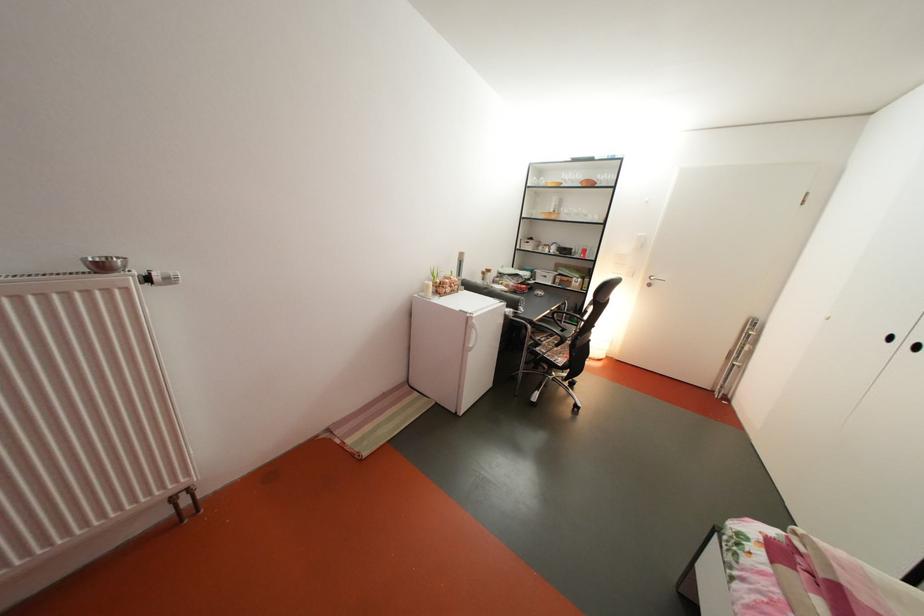
Where would you turn the radiator thermostat knob? Please return your answer as a coordinate pair (x, y).

(164, 278)